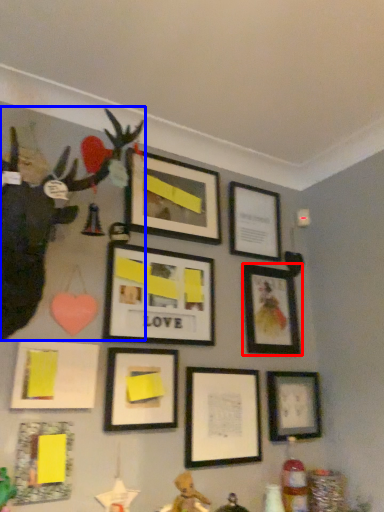
Question: Among these objects, which one is nearest to the camera, picture frame (highlighted by a red box) or toy (highlighted by a blue box)?

Choices:
 (A) picture frame
 (B) toy

Answer: (B)